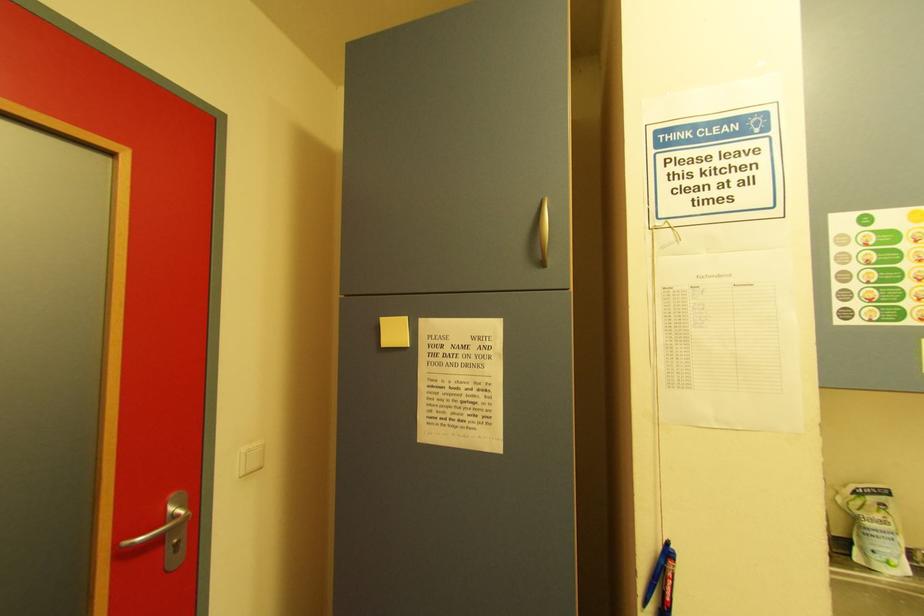
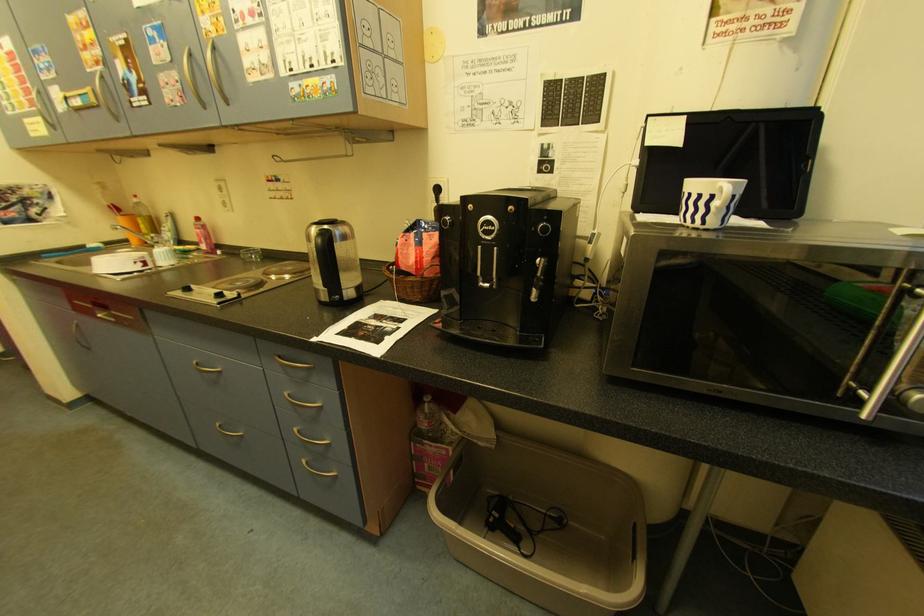
Question: What movement of the cameraman would produce the second image?

Choices:
 (A) Left
 (B) Right
 (C) Forward
 (D) Backward

Answer: (B)